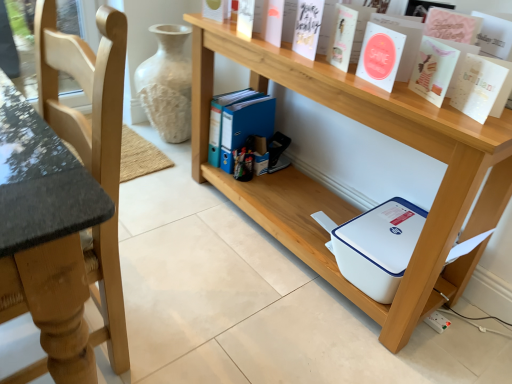
This screenshot has width=512, height=384. I want to click on free space to the left of white paper at upper right, acting as the fifth paperback book starting from the left, so click(x=418, y=104).